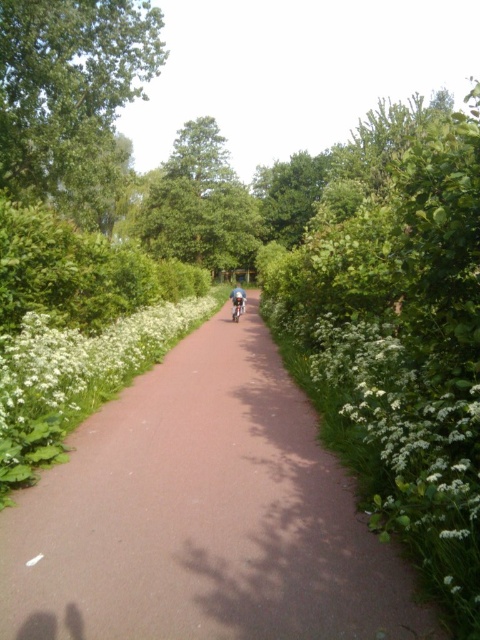
You are a gardener who needs to determine which object is narrower between the white fluffy flowers at center and the green leafy tree at center. Which one is thinner?

The white fluffy flowers at center is thinner than the green leafy tree at center.